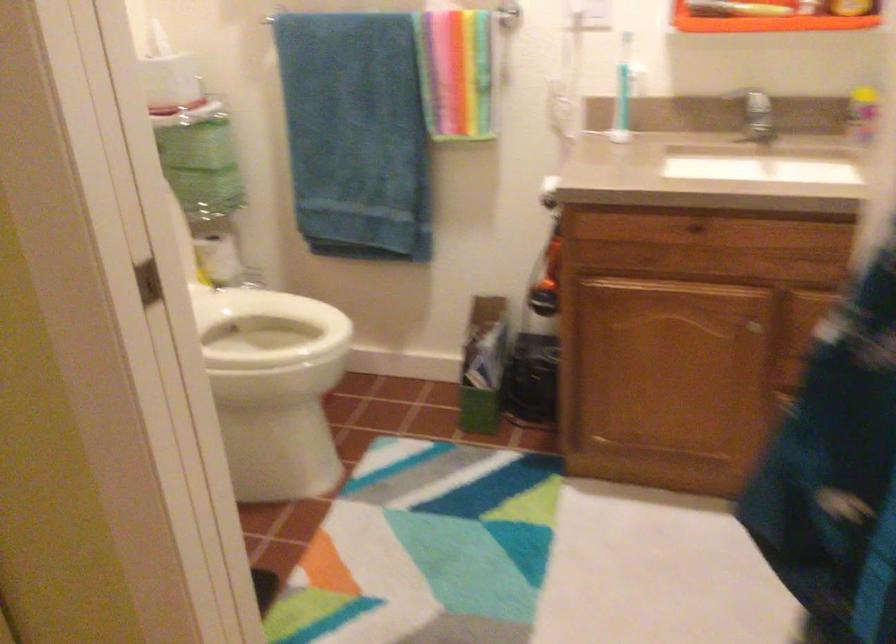
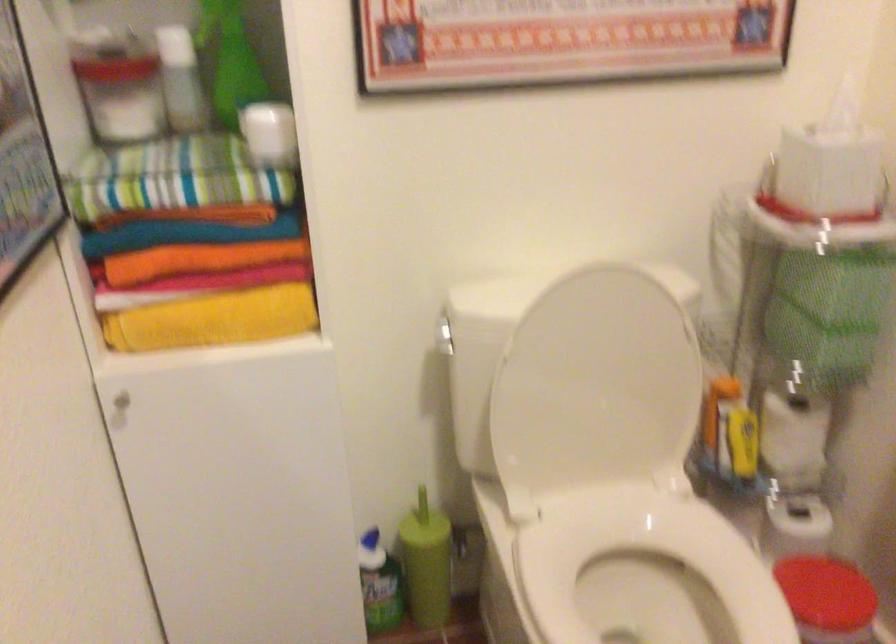
Find the pixel in the second image that matches (x=217, y=259) in the first image.

(793, 440)